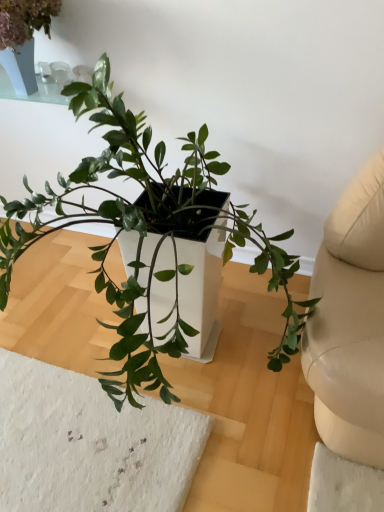
The width and height of the screenshot is (384, 512). Describe the element at coordinates (23, 38) in the screenshot. I see `green matte plant at upper left, the 2th houseplant viewed from the right` at that location.

You are a GUI agent. You are given a task and a screenshot of the screen. Output one action in this format:
    pyautogui.click(x=<x>, y=<y>)
    Task: Click on the green matte plant at upper left, the 1th houseplant from the left
    The width and height of the screenshot is (384, 512).
    Given the screenshot: What is the action you would take?
    pyautogui.click(x=23, y=38)

This screenshot has height=512, width=384. Describe the element at coordinates (149, 234) in the screenshot. I see `green matte plant at center, the 1th houseplant in the right-to-left sequence` at that location.

Locate an element on the screen. This screenshot has width=384, height=512. green matte plant at center, the 2th houseplant viewed from the left is located at coordinates (149, 234).

Identify the location of green matte plant at upper left, the 1th houseplant from the left. (23, 38).

Considering the positions of objects green matte plant at upper left, the 2th houseplant viewed from the right, and green matte plant at center, the 2th houseplant viewed from the left, in the image provided, who is more to the left, green matte plant at upper left, the 2th houseplant viewed from the right, or green matte plant at center, the 2th houseplant viewed from the left,?

green matte plant at upper left, the 2th houseplant viewed from the right.

Which object is closer to the camera, green matte plant at upper left, the 2th houseplant viewed from the right, or green matte plant at center, the 2th houseplant viewed from the left?

green matte plant at center, the 2th houseplant viewed from the left, is in front.

Considering the positions of point (30, 84) and point (45, 200), is point (30, 84) closer or farther from the camera than point (45, 200)?

Clearly, point (30, 84) is more distant from the camera than point (45, 200).

From the image's perspective, which one is positioned lower, green matte plant at upper left, the 2th houseplant viewed from the right, or green matte plant at center, the 1th houseplant in the right-to-left sequence?

From the image's view, green matte plant at center, the 1th houseplant in the right-to-left sequence, is below.

From a real-world perspective, relative to green matte plant at center, the 2th houseplant viewed from the left, is green matte plant at upper left, the 2th houseplant viewed from the right, vertically above or below?

Clearly, from a real-world perspective, green matte plant at upper left, the 2th houseplant viewed from the right, is above green matte plant at center, the 2th houseplant viewed from the left.

Is green matte plant at upper left, the 1th houseplant from the left, wider than green matte plant at center, the 1th houseplant in the right-to-left sequence?

In fact, green matte plant at upper left, the 1th houseplant from the left, might be narrower than green matte plant at center, the 1th houseplant in the right-to-left sequence.

Which of these two, green matte plant at upper left, the 2th houseplant viewed from the right, or green matte plant at center, the 2th houseplant viewed from the left, stands taller?

green matte plant at center, the 2th houseplant viewed from the left.

Can you confirm if green matte plant at upper left, the 1th houseplant from the left, is bigger than green matte plant at center, the 2th houseplant viewed from the left?

No, green matte plant at upper left, the 1th houseplant from the left, is not bigger than green matte plant at center, the 2th houseplant viewed from the left.

Is green matte plant at center, the 1th houseplant in the right-to-left sequence, surrounded by green matte plant at upper left, the 1th houseplant from the left?

No, green matte plant at center, the 1th houseplant in the right-to-left sequence, is located outside of green matte plant at upper left, the 1th houseplant from the left.

Is the surface of green matte plant at upper left, the 2th houseplant viewed from the right, in direct contact with green matte plant at center, the 1th houseplant in the right-to-left sequence?

green matte plant at upper left, the 2th houseplant viewed from the right, is not next to green matte plant at center, the 1th houseplant in the right-to-left sequence, and they're not touching.

Is green matte plant at upper left, the 2th houseplant viewed from the right, facing away from green matte plant at center, the 1th houseplant in the right-to-left sequence?

green matte plant at upper left, the 2th houseplant viewed from the right, is not turned away from green matte plant at center, the 1th houseplant in the right-to-left sequence.

How many degrees apart are the facing directions of green matte plant at upper left, the 2th houseplant viewed from the right, and green matte plant at center, the 1th houseplant in the right-to-left sequence?

The angular difference between green matte plant at upper left, the 2th houseplant viewed from the right, and green matte plant at center, the 1th houseplant in the right-to-left sequence, is 0.601 degrees.

You are a GUI agent. You are given a task and a screenshot of the screen. Output one action in this format:
    pyautogui.click(x=<x>, y=<y>)
    Task: Click on the houseplant that appears above the green matte plant at center, the 2th houseplant viewed from the left (from a real-world perspective)
    
    Given the screenshot: What is the action you would take?
    pyautogui.click(x=23, y=38)

In the image, is green matte plant at center, the 1th houseplant in the right-to-left sequence, on the left side or the right side of green matte plant at upper left, the 2th houseplant viewed from the right?

From the image, it's evident that green matte plant at center, the 1th houseplant in the right-to-left sequence, is to the right of green matte plant at upper left, the 2th houseplant viewed from the right.

Which object is more forward, green matte plant at center, the 1th houseplant in the right-to-left sequence, or green matte plant at upper left, the 1th houseplant from the left?

green matte plant at center, the 1th houseplant in the right-to-left sequence.

Between point (190, 266) and point (4, 1), which one is positioned in front?

The point (190, 266) is closer.

From the image's perspective, which is below, green matte plant at center, the 1th houseplant in the right-to-left sequence, or green matte plant at upper left, the 2th houseplant viewed from the right?

green matte plant at center, the 1th houseplant in the right-to-left sequence, appears lower in the image.

From a real-world perspective, who is located lower, green matte plant at center, the 1th houseplant in the right-to-left sequence, or green matte plant at upper left, the 2th houseplant viewed from the right?

From a 3D spatial view, green matte plant at center, the 1th houseplant in the right-to-left sequence, is below.

Considering the sizes of objects green matte plant at center, the 1th houseplant in the right-to-left sequence, and green matte plant at upper left, the 2th houseplant viewed from the right, in the image provided, who is wider, green matte plant at center, the 1th houseplant in the right-to-left sequence, or green matte plant at upper left, the 2th houseplant viewed from the right,?

green matte plant at center, the 1th houseplant in the right-to-left sequence.

Between green matte plant at center, the 2th houseplant viewed from the left, and green matte plant at upper left, the 1th houseplant from the left, which one has more height?

green matte plant at center, the 2th houseplant viewed from the left, is taller.

Considering the relative sizes of green matte plant at center, the 2th houseplant viewed from the left, and green matte plant at upper left, the 2th houseplant viewed from the right, in the image provided, is green matte plant at center, the 2th houseplant viewed from the left, smaller than green matte plant at upper left, the 2th houseplant viewed from the right,?

No, green matte plant at center, the 2th houseplant viewed from the left, is not smaller than green matte plant at upper left, the 2th houseplant viewed from the right.

Is green matte plant at center, the 1th houseplant in the right-to-left sequence, situated inside green matte plant at upper left, the 1th houseplant from the left, or outside?

green matte plant at center, the 1th houseplant in the right-to-left sequence, exists outside the volume of green matte plant at upper left, the 1th houseplant from the left.

Is green matte plant at center, the 2th houseplant viewed from the left, touching green matte plant at upper left, the 2th houseplant viewed from the right?

They are not placed beside each other.

Could you tell me if green matte plant at center, the 2th houseplant viewed from the left, is facing green matte plant at upper left, the 1th houseplant from the left?

No, green matte plant at center, the 2th houseplant viewed from the left, is not turned towards green matte plant at upper left, the 1th houseplant from the left.

What's the angular difference between green matte plant at center, the 2th houseplant viewed from the left, and green matte plant at upper left, the 1th houseplant from the left,'s facing directions?

They differ by 0.601 degrees in their facing directions.

Image resolution: width=384 pixels, height=512 pixels. I want to click on houseplant above the green matte plant at center, the 1th houseplant in the right-to-left sequence (from a real-world perspective), so click(23, 38).

Where is `houseplant on the right side of green matte plant at upper left, the 1th houseplant from the left`? This screenshot has width=384, height=512. houseplant on the right side of green matte plant at upper left, the 1th houseplant from the left is located at coordinates [149, 234].

I want to click on houseplant that is on the left side of green matte plant at center, the 2th houseplant viewed from the left, so click(23, 38).